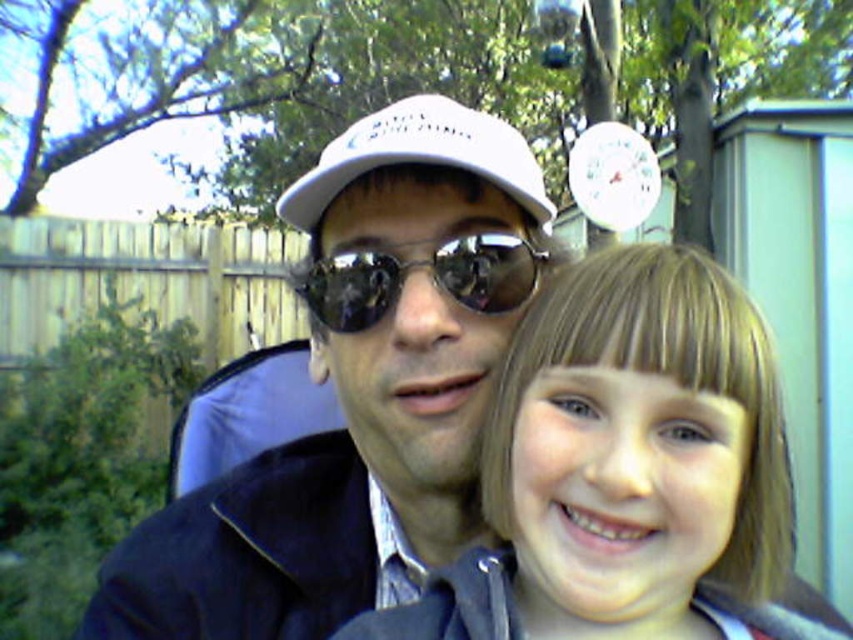
You are a photographer trying to capture a candid shot of the two subjects in the scene. Since you want to ensure both the matte white cap at center and the smooth blonde hair at center are clearly visible in your frame, which object should you position closer to the left side of your camera viewfinder?

You should position the matte white cap at center closer to the left side of your camera viewfinder because it is already located to the left of the smooth blonde hair at center in the scene.

You are a photographer trying to capture a candid shot of the two people in the scene. You notice the smooth blonde hair at center and the shiny reflective sunglasses at center. Which object is positioned to the right side of the other?

The smooth blonde hair at center is to the right of the shiny reflective sunglasses at center.